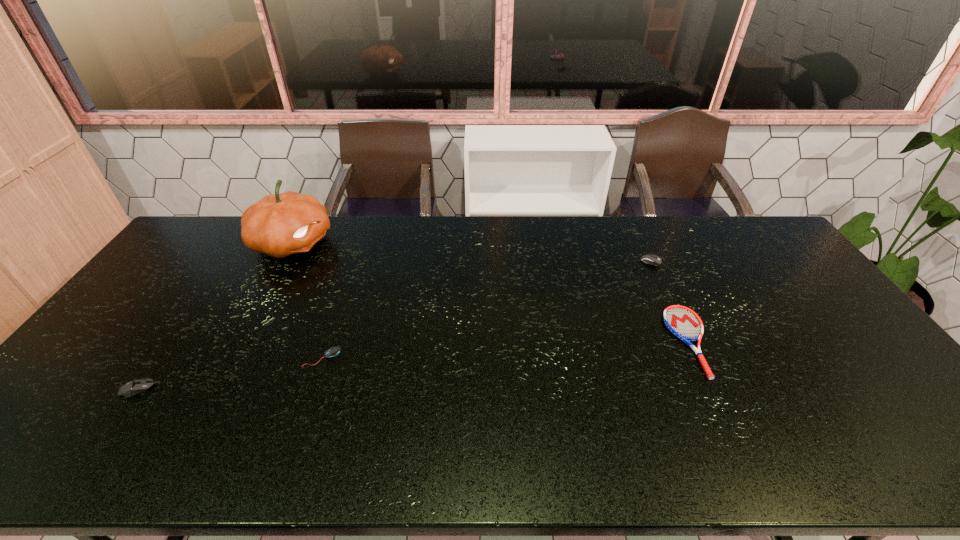
You are a GUI agent. You are given a task and a screenshot of the screen. Output one action in this format:
    pyautogui.click(x=<x>, y=<y>)
    Task: Click on the unoccupied position between the tennis racket and the farthest mouse
    
    Given the screenshot: What is the action you would take?
    pyautogui.click(x=675, y=300)

Identify which object is the third nearest to the second nearest mouse. Please provide its 2D coordinates. Your answer should be formatted as a tuple, i.e. [(x, y)], where the tuple contains the x and y coordinates of a point satisfying the conditions above.

[(684, 323)]

Choose which object is the third nearest neighbor to the tennis racket. Please provide its 2D coordinates. Your answer should be formatted as a tuple, i.e. [(x, y)], where the tuple contains the x and y coordinates of a point satisfying the conditions above.

[(279, 225)]

Where is `the second closest mouse to the tennis racket`? the second closest mouse to the tennis racket is located at coordinates (334, 351).

The width and height of the screenshot is (960, 540). I want to click on mouse that stands as the second closest to the nearest object, so click(650, 259).

Find the location of `blank space that satisfies the following two spatial constraints: 1. on the front face of the pumpkin; 2. on the right side of the tennis racket`. blank space that satisfies the following two spatial constraints: 1. on the front face of the pumpkin; 2. on the right side of the tennis racket is located at coordinates (240, 341).

Find the location of a particular element. vacant area in the image that satisfies the following two spatial constraints: 1. on the front face of the farthest mouse; 2. on the left side of the pumpkin is located at coordinates (284, 259).

You are a GUI agent. You are given a task and a screenshot of the screen. Output one action in this format:
    pyautogui.click(x=<x>, y=<y>)
    Task: Click on the blank area in the image that satisfies the following two spatial constraints: 1. on the front face of the pumpkin; 2. on the left side of the tennis racket
    
    Given the screenshot: What is the action you would take?
    pyautogui.click(x=240, y=341)

The image size is (960, 540). I want to click on vacant region that satisfies the following two spatial constraints: 1. on the front face of the tallest object; 2. on the back side of the tennis racket, so click(x=240, y=341).

In order to click on vacant space that satisfies the following two spatial constraints: 1. on the front face of the tallest object; 2. on the left side of the tennis racket in this screenshot , I will do `click(240, 341)`.